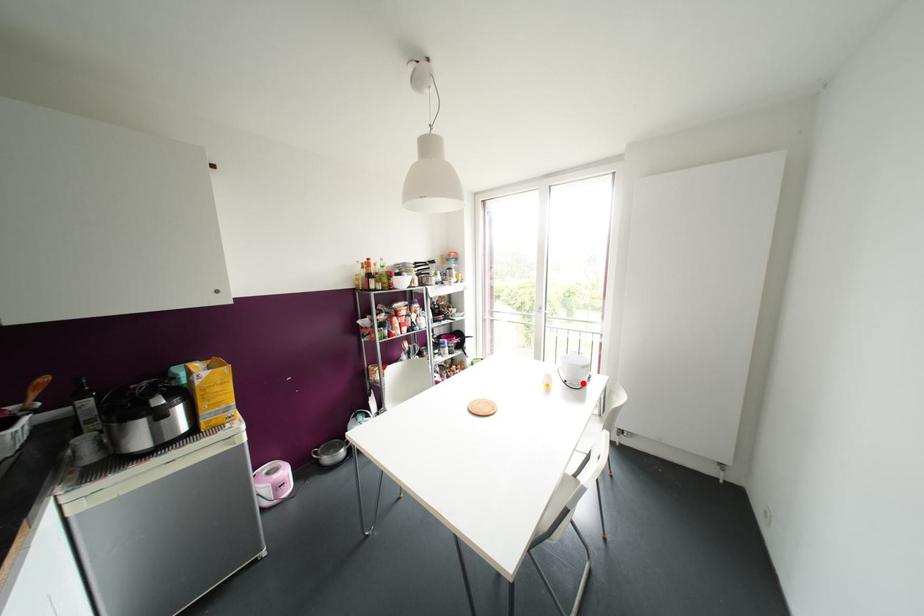
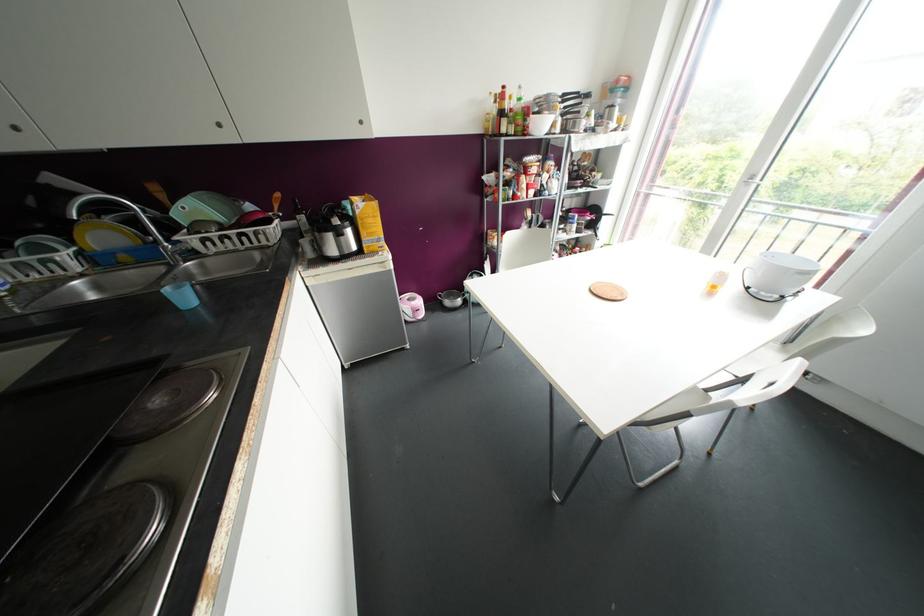
The point at the highlighted location is marked in the first image. Where is the corresponding point in the second image?

(782, 297)